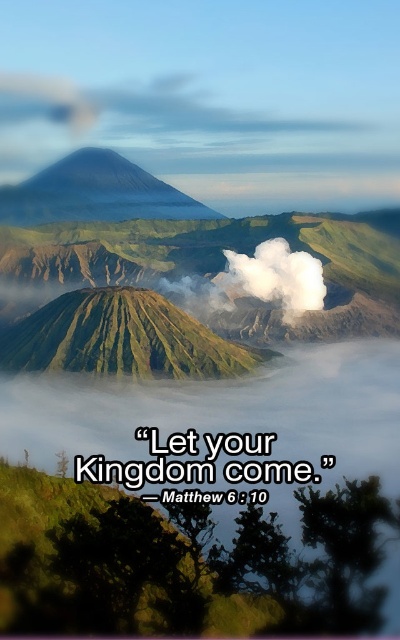
You are a hiker standing at the base of the green grassy mountain at center. You want to reach the summit. Given that your average hiking pace is 3 km per hour, how long would it take you to reach the summit if you maintain this pace?

The distance of green grassy mountain at center from viewer is 274.76 meters. At an average hiking pace of 3 km per hour, it would take approximately 5.5 minutes to reach the summit.

Consider the image. You are an astronaut observing Earth from a spacecraft. You notice two features in the image below. Which object is smaller in size between the green grassy mountain at center and the white fluffy cloud at upper left?

The green grassy mountain at center is smaller in size compared to the white fluffy cloud at upper left.